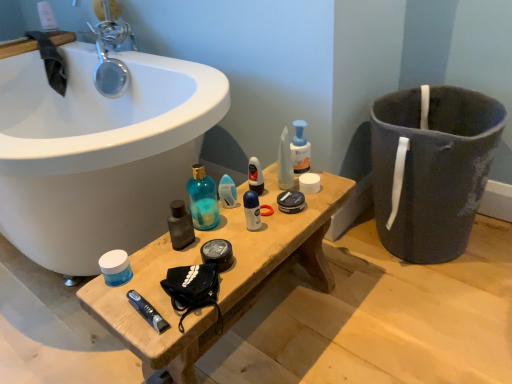
This screenshot has width=512, height=384. Find the location of `free space between white matte deodorant at center, the 2th toiletry in the right-to-left sequence, and translucent plastic soap dispenser at center, marked as the 3th toiletry in a left-to-right arrangement`. free space between white matte deodorant at center, the 2th toiletry in the right-to-left sequence, and translucent plastic soap dispenser at center, marked as the 3th toiletry in a left-to-right arrangement is located at coordinates (271, 200).